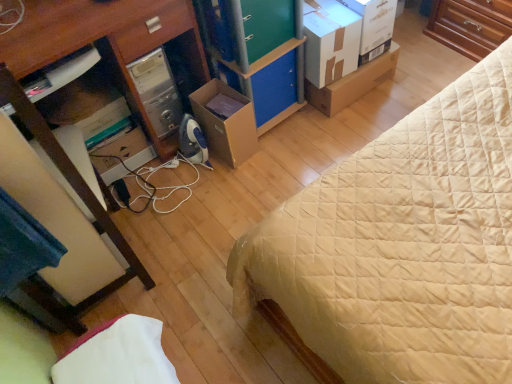
Question: From the image's perspective, does beige quilted bed at center appear higher than wooden desk at left?

Choices:
 (A) no
 (B) yes

Answer: (B)

Question: Is beige quilted bed at center to the left of wooden desk at left from the viewer's perspective?

Choices:
 (A) yes
 (B) no

Answer: (B)

Question: Does beige quilted bed at center contain wooden desk at left?

Choices:
 (A) yes
 (B) no

Answer: (B)

Question: Can you confirm if beige quilted bed at center is thinner than wooden desk at left?

Choices:
 (A) no
 (B) yes

Answer: (A)

Question: From a real-world perspective, is beige quilted bed at center located higher than wooden desk at left?

Choices:
 (A) yes
 (B) no

Answer: (B)

Question: Do you think blue felt drawer at center, which is the 2th drawer in top-to-bottom order, is within brown cardboard box at center, which is counted as the 3th cardboard box, starting from the right, or outside of it?

Choices:
 (A) inside
 (B) outside

Answer: (B)

Question: Based on their sizes in the image, would you say blue felt drawer at center, which is the 2th drawer in top-to-bottom order, is bigger or smaller than brown cardboard box at center, which is counted as the 3th cardboard box, starting from the right?

Choices:
 (A) small
 (B) big

Answer: (A)

Question: In terms of height, does blue felt drawer at center, which is the 2th drawer in top-to-bottom order, look taller or shorter compared to brown cardboard box at center, which is counted as the 3th cardboard box, starting from the right?

Choices:
 (A) short
 (B) tall

Answer: (A)

Question: Is blue felt drawer at center, which is the 2th drawer in top-to-bottom order, to the left or to the right of brown cardboard box at center, which is counted as the 3th cardboard box, starting from the right, in the image?

Choices:
 (A) left
 (B) right

Answer: (B)

Question: Considering the positions of white cardboard box at upper right and wooden desk at left in the image, is white cardboard box at upper right taller or shorter than wooden desk at left?

Choices:
 (A) short
 (B) tall

Answer: (A)

Question: Is white cardboard box at upper right bigger or smaller than wooden desk at left?

Choices:
 (A) small
 (B) big

Answer: (A)

Question: From the image's perspective, is white cardboard box at upper right above or below wooden desk at left?

Choices:
 (A) above
 (B) below

Answer: (A)

Question: Is point (373, 21) closer or farther from the camera than point (79, 193)?

Choices:
 (A) closer
 (B) farther

Answer: (B)

Question: Relative to blue felt drawer at center, which is the 2th drawer in top-to-bottom order, is brown wood dresser at upper right in front or behind?

Choices:
 (A) front
 (B) behind

Answer: (B)

Question: Is point (438, 34) closer or farther from the camera than point (256, 82)?

Choices:
 (A) farther
 (B) closer

Answer: (A)